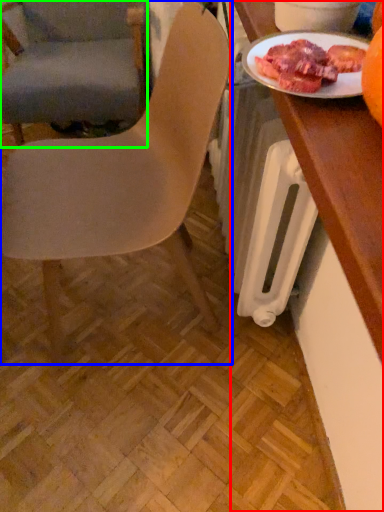
Question: Estimate the real-world distances between objects in this image. Which object is farther from desk (highlighted by a red box), chair (highlighted by a blue box) or chair (highlighted by a green box)?

Choices:
 (A) chair
 (B) chair

Answer: (B)